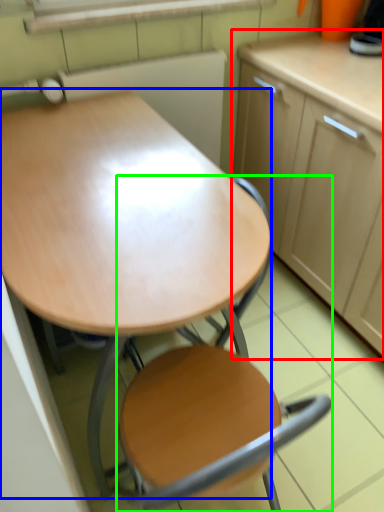
Question: Which object is the farthest from cabinetry (highlighted by a red box)? Choose among these: desk (highlighted by a blue box) or chair (highlighted by a green box).

Choices:
 (A) desk
 (B) chair

Answer: (B)